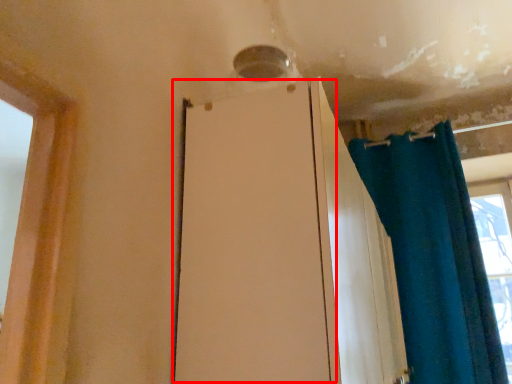
Question: Considering the relative positions of screen door (annotated by the red box) and curtain in the image provided, where is screen door (annotated by the red box) located with respect to the staircase?

Choices:
 (A) right
 (B) left

Answer: (B)